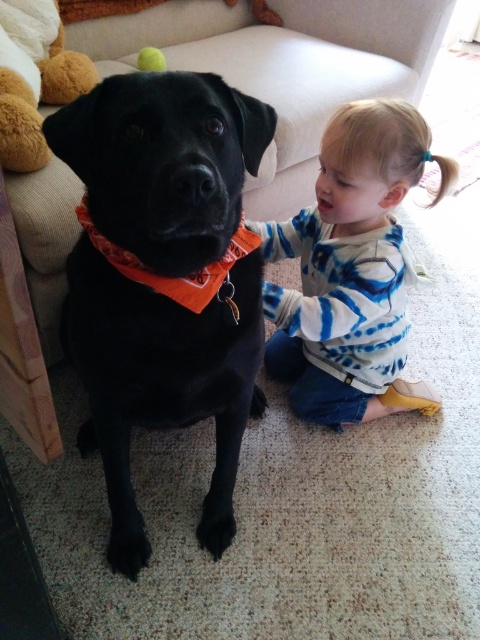
You are a photographer trying to capture the child reaching towards the black Labrador Retriever. The blue tie dye shirt at lower right is represented by point (348, 266). Where should you position your camera to ensure the blue tie dye shirt at lower right is in the center of the photo?

To center the blue tie dye shirt at point (348, 266), position the camera so the shirt is at the photo frame midpoint. Since the shirt is at coordinates 0.416 horizontally and 0.727 vertically, adjust the camera to align its lens directly over those coordinates to center it in the image.